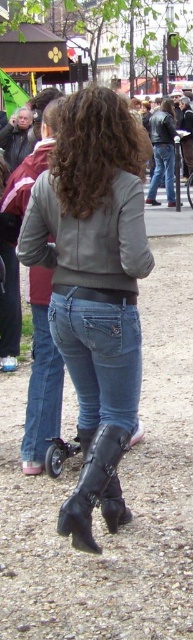
You are a photographer trying to capture the subject wearing jeans at center and denim at center. Which item of clothing is visible on top?

The jeans at center is positioned over denim at center, so the jeans at center is visible on top.

You are standing at point (159, 170) and want to walk to the person in the image. Which direction should you move relative to point (37, 417)?

You should move towards point (37, 417) because it is in front of point (159, 170), so moving towards it would lead you closer to the person.

You are standing behind a person wearing jeans at center and denim at center. Which clothing item is positioned to the right?

The jeans at center is positioned to the right of the denim at center.